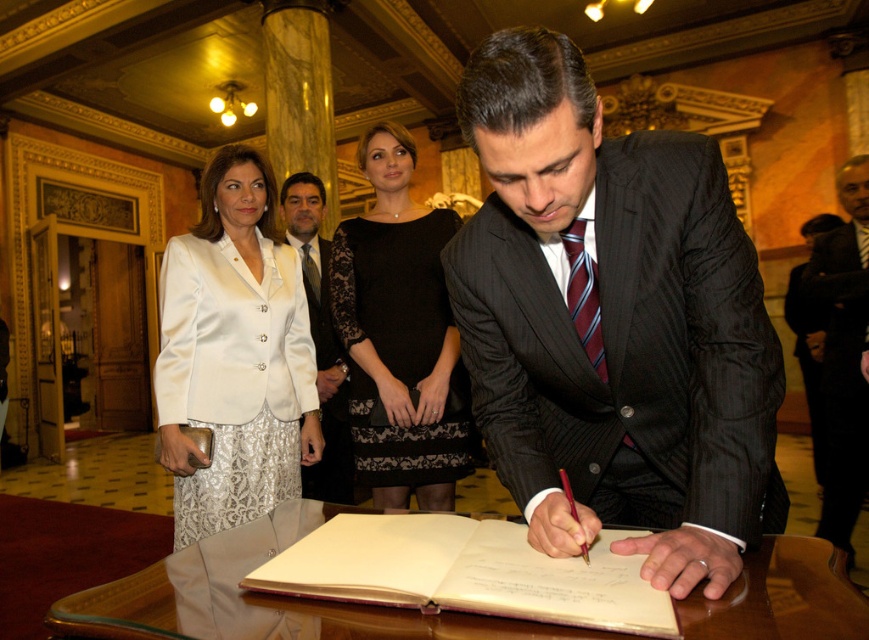
Between satin white blazer at upper left and off-white paper at center, which one is positioned higher?

satin white blazer at upper left

Is satin white blazer at upper left shorter than off-white paper at center?

Incorrect, satin white blazer at upper left's height does not fall short of off-white paper at center's.

The image size is (869, 640). What do you see at coordinates (234, 355) in the screenshot?
I see `satin white blazer at upper left` at bounding box center [234, 355].

This screenshot has height=640, width=869. I want to click on satin white blazer at upper left, so click(x=234, y=355).

Between transparent glass table at center and dark gray suit at right, which one is positioned lower?

transparent glass table at center is below.

Is transparent glass table at center behind dark gray suit at right?

No, it is not.

Describe the element at coordinates (260, 600) in the screenshot. I see `transparent glass table at center` at that location.

Where is `transparent glass table at center`? The width and height of the screenshot is (869, 640). transparent glass table at center is located at coordinates (260, 600).

Is satin white blazer at upper left positioned before white satin suit at upper left?

That is True.

Is point (217, 276) less distant than point (303, 221)?

Yes.

This screenshot has width=869, height=640. I want to click on satin white blazer at upper left, so click(234, 355).